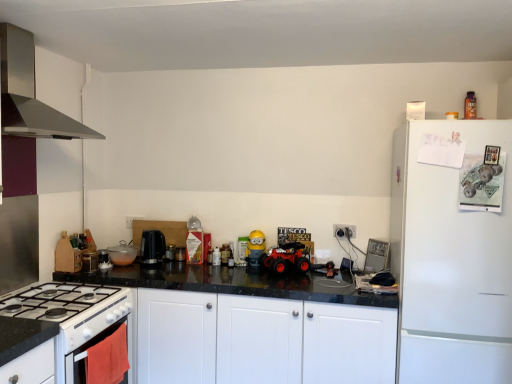
The image size is (512, 384). Identify the location of free space in front of black plastic coffee machine at center. (152, 271).